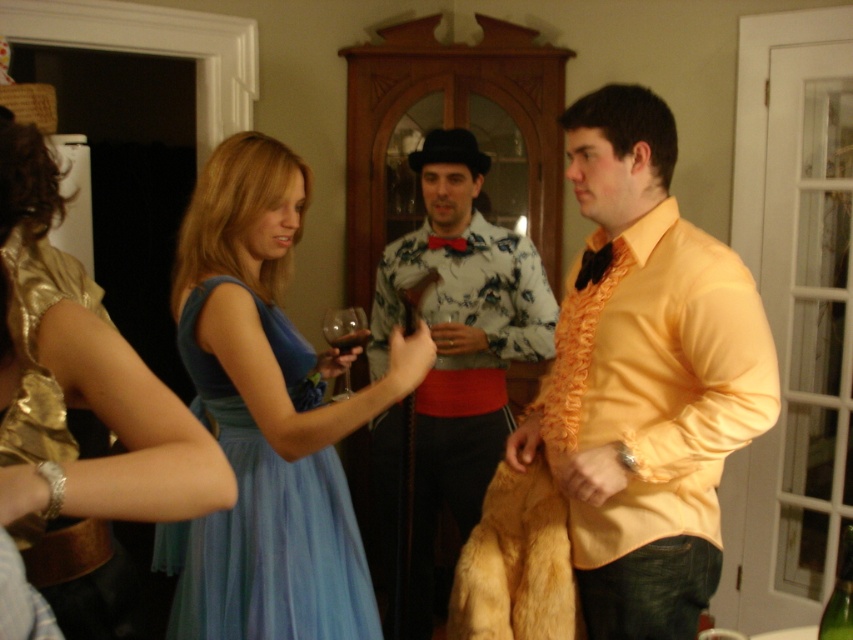
Can you confirm if matte blue dress at center is positioned above floral shirt at center?

Correct, matte blue dress at center is located above floral shirt at center.

Where is `matte blue dress at center`? This screenshot has height=640, width=853. matte blue dress at center is located at coordinates (80, 416).

Between point (44, 512) and point (509, 420), which one is positioned in front?

Point (44, 512) is in front.

Where is `matte blue dress at center`? matte blue dress at center is located at coordinates (80, 416).

Who is more distant from viewer, (665, 536) or (340, 339)?

The point (340, 339) is behind.

Is point (621, 364) more distant than point (357, 339)?

That is False.

Who is more distant from viewer, (718, 300) or (337, 349)?

Point (337, 349)

Identify the location of matte yellow shirt at center. (645, 378).

Who is shorter, floral shirt at center or translucent glass wine at center?

translucent glass wine at center is shorter.

Between floral shirt at center and translucent glass wine at center, which one appears on the right side from the viewer's perspective?

From the viewer's perspective, floral shirt at center appears more on the right side.

I want to click on floral shirt at center, so click(457, 346).